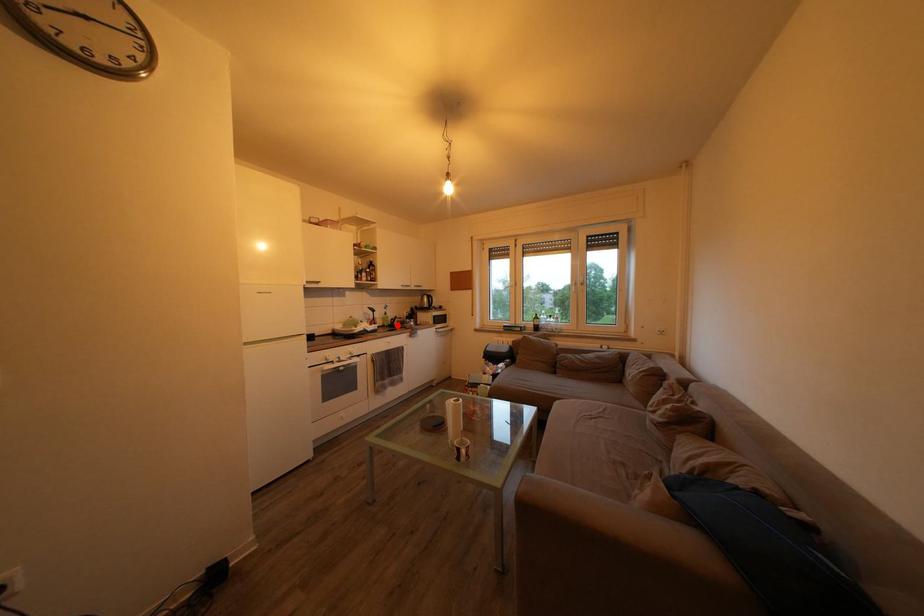
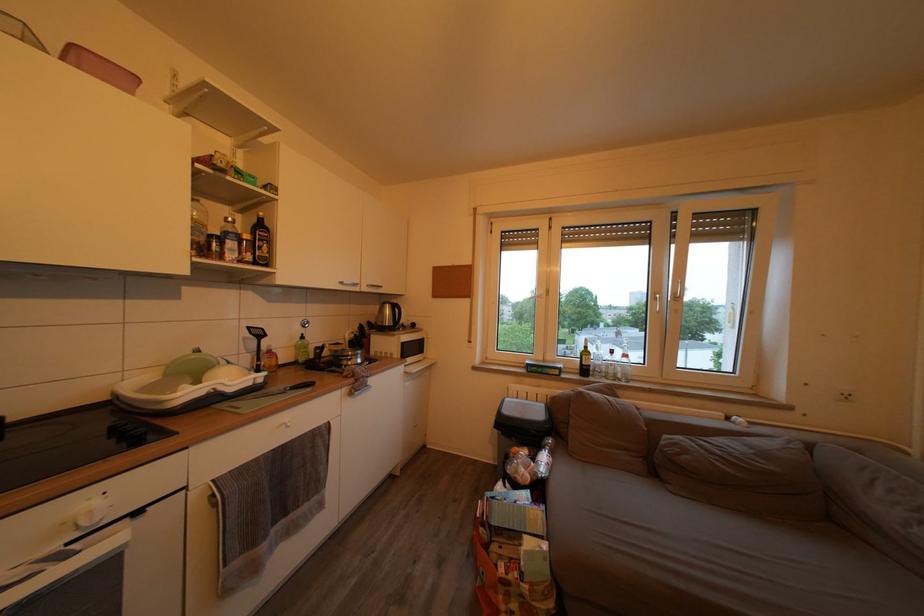
Question: I am providing you with two images of the same scene from different viewpoints. A red point is marked on the first image. Is the red point's position out of view in image 2?

Choices:
 (A) Yes
 (B) No

Answer: (B)